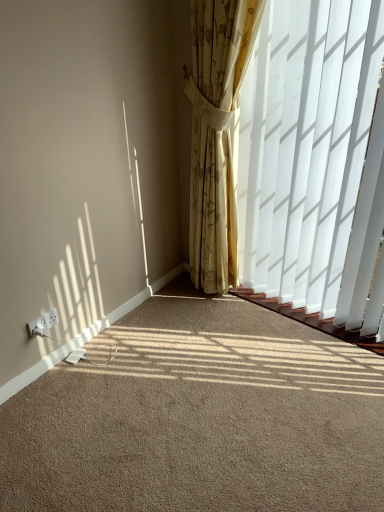
Question: Can you confirm if beige carpet at lower left is thinner than white plastic electric outlet at lower left?

Choices:
 (A) no
 (B) yes

Answer: (A)

Question: Is beige carpet at lower left far from white plastic electric outlet at lower left?

Choices:
 (A) no
 (B) yes

Answer: (A)

Question: Does beige carpet at lower left come behind white plastic electric outlet at lower left?

Choices:
 (A) no
 (B) yes

Answer: (A)

Question: Can you confirm if beige carpet at lower left is wider than white plastic electric outlet at lower left?

Choices:
 (A) no
 (B) yes

Answer: (B)

Question: Is beige carpet at lower left facing towards white plastic electric outlet at lower left?

Choices:
 (A) no
 (B) yes

Answer: (A)

Question: Which is correct: beige carpet at lower left is inside white plastic electric outlet at lower left, or outside of it?

Choices:
 (A) outside
 (B) inside

Answer: (A)

Question: From a real-world perspective, is beige carpet at lower left above or below white plastic electric outlet at lower left?

Choices:
 (A) below
 (B) above

Answer: (A)

Question: In terms of size, does beige carpet at lower left appear bigger or smaller than white plastic electric outlet at lower left?

Choices:
 (A) big
 (B) small

Answer: (A)

Question: From the image's perspective, is beige carpet at lower left located above or below white plastic electric outlet at lower left?

Choices:
 (A) below
 (B) above

Answer: (A)

Question: In terms of height, does yellow floral fabric curtain at center look taller or shorter compared to beige carpet at lower left?

Choices:
 (A) tall
 (B) short

Answer: (A)

Question: From the image's perspective, is yellow floral fabric curtain at center positioned above or below beige carpet at lower left?

Choices:
 (A) above
 (B) below

Answer: (A)

Question: Is yellow floral fabric curtain at center to the left or to the right of beige carpet at lower left in the image?

Choices:
 (A) right
 (B) left

Answer: (A)

Question: Considering the positions of point [x=221, y=147] and point [x=112, y=401], is point [x=221, y=147] closer or farther from the camera than point [x=112, y=401]?

Choices:
 (A) farther
 (B) closer

Answer: (A)

Question: From the image's perspective, relative to beige carpet at lower left, is white plastic electric outlet at lower left above or below?

Choices:
 (A) below
 (B) above

Answer: (B)

Question: From a real-world perspective, is white plastic electric outlet at lower left physically located above or below beige carpet at lower left?

Choices:
 (A) above
 (B) below

Answer: (A)